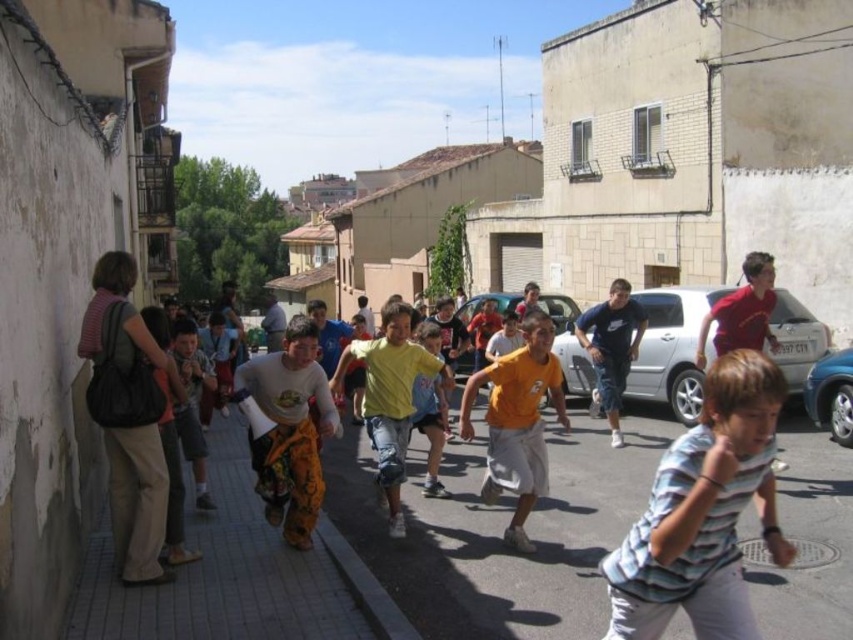
Question: Among these points, which one is farthest from the camera?

Choices:
 (A) tap(561, 422)
 (B) tap(735, 404)
 (C) tap(395, 515)
 (D) tap(392, 588)

Answer: (A)

Question: Considering the real-world distances, which object is closest to the orange cotton shirt at center?

Choices:
 (A) brown brick pavement at lower left
 (B) yellow cotton shirt at center
 (C) gray asphalt at center
 (D) striped cotton shirt at center

Answer: (B)

Question: Does orange cotton shirt at center lie behind yellow cotton shirt at center?

Choices:
 (A) yes
 (B) no

Answer: (B)

Question: Which of the following is the closest to the observer?

Choices:
 (A) yellow cotton shirt at center
 (B) striped cotton shirt at center
 (C) brown brick pavement at lower left

Answer: (B)

Question: Observing the image, what is the correct spatial positioning of striped cotton shirt at center in reference to yellow cotton shirt at center?

Choices:
 (A) above
 (B) below

Answer: (B)

Question: Can you confirm if striped cotton shirt at center is positioned above brown brick pavement at lower left?

Choices:
 (A) no
 (B) yes

Answer: (B)